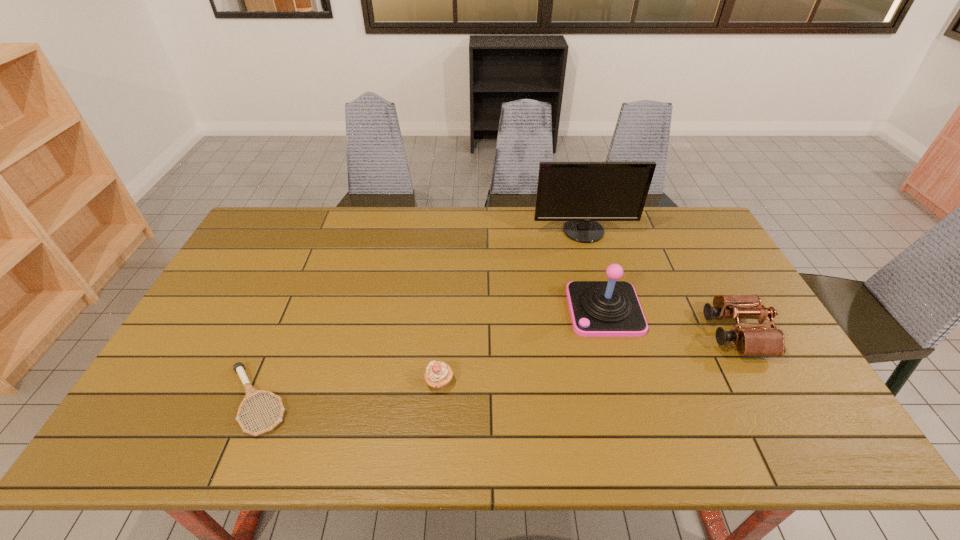
Find the location of `free point between the joystick and the monitor`. free point between the joystick and the monitor is located at coordinates (594, 271).

Where is `vacant space that is in between the fourth shortest object and the rightmost object`? The height and width of the screenshot is (540, 960). vacant space that is in between the fourth shortest object and the rightmost object is located at coordinates (670, 321).

What are the coordinates of `free area in between the cupcake and the monitor` in the screenshot? It's located at (512, 307).

At what (x,y) coordinates should I click in order to perform the action: click on free space between the shortest object and the cupcake. Please return your answer as a coordinate pair (x, y). The image size is (960, 540). Looking at the image, I should click on (348, 391).

At what (x,y) coordinates should I click in order to perform the action: click on empty location between the shortest object and the fourth object from right to left. Please return your answer as a coordinate pair (x, y). Looking at the image, I should click on (348, 391).

Where is `free area in between the fourth shortest object and the binoculars`? The width and height of the screenshot is (960, 540). free area in between the fourth shortest object and the binoculars is located at coordinates (670, 321).

Where is `free point between the rightmost object and the fourth shortest object`? This screenshot has width=960, height=540. free point between the rightmost object and the fourth shortest object is located at coordinates (670, 321).

Where is `object that is the fourth closest one to the tallest object`? The image size is (960, 540). object that is the fourth closest one to the tallest object is located at coordinates pyautogui.click(x=250, y=391).

The height and width of the screenshot is (540, 960). Identify the location of object that is the fourth nearest to the leftmost object. (756, 340).

This screenshot has height=540, width=960. Identify the location of vacant space that satisfies the following two spatial constraints: 1. on the back side of the leftmost object; 2. on the left side of the fourth tallest object. (264, 382).